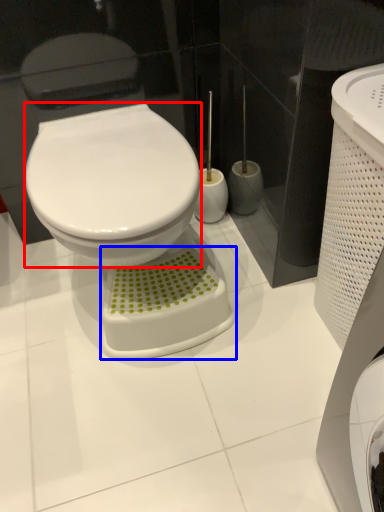
Question: Which object appears closest to the camera in this image, bidet (highlighted by a red box) or porcelain (highlighted by a blue box)?

Choices:
 (A) bidet
 (B) porcelain

Answer: (A)